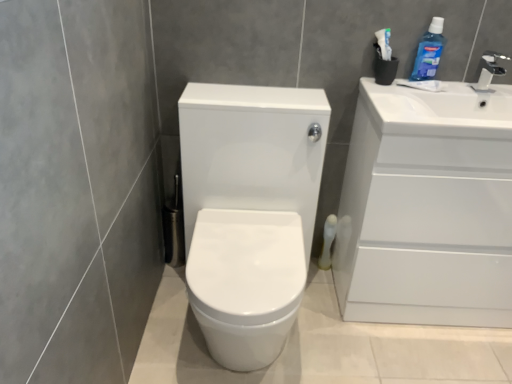
The image size is (512, 384). I want to click on free space between white glossy faucet at upper right and blue glossy mouthwash at upper right, so click(456, 81).